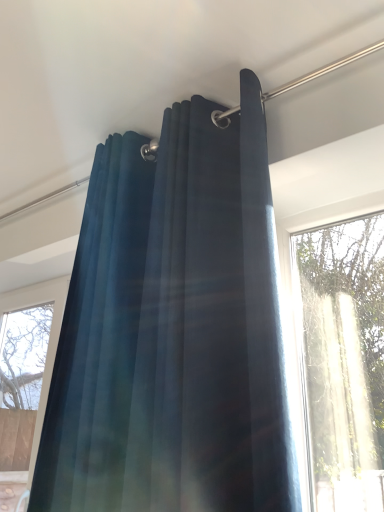
Locate an element on the screen. Image resolution: width=384 pixels, height=512 pixels. velvet dark blue curtain at left is located at coordinates (98, 339).

This screenshot has width=384, height=512. What do you see at coordinates (98, 339) in the screenshot?
I see `velvet dark blue curtain at left` at bounding box center [98, 339].

Locate an element on the screen. velvet dark blue curtain at upper center is located at coordinates pos(174,329).

In order to face velvet dark blue curtain at upper center, should I rotate leftwards or rightwards?

Turn right by 2.327 degrees to look at velvet dark blue curtain at upper center.

Measure the distance between point (75, 346) and camera.

Point (75, 346) and camera are 1.02 meters apart from each other.

The height and width of the screenshot is (512, 384). What do you see at coordinates (174, 329) in the screenshot? I see `velvet dark blue curtain at upper center` at bounding box center [174, 329].

Locate an element on the screen. Image resolution: width=384 pixels, height=512 pixels. velvet dark blue curtain at left is located at coordinates (98, 339).

Does velvet dark blue curtain at left appear on the left side of velvet dark blue curtain at upper center?

Correct, you'll find velvet dark blue curtain at left to the left of velvet dark blue curtain at upper center.

Is velvet dark blue curtain at left in front of or behind velvet dark blue curtain at upper center in the image?

Clearly, velvet dark blue curtain at left is behind velvet dark blue curtain at upper center.

Which is in front, point (136, 300) or point (81, 283)?

The point (136, 300) is in front.

From the image's perspective, is velvet dark blue curtain at left located above or below velvet dark blue curtain at upper center?

From the image's perspective, velvet dark blue curtain at left appears below velvet dark blue curtain at upper center.

From a real-world perspective, who is located higher, velvet dark blue curtain at left or velvet dark blue curtain at upper center?

In real-world perspective, velvet dark blue curtain at upper center is above.

Considering the sizes of velvet dark blue curtain at left and velvet dark blue curtain at upper center in the image, is velvet dark blue curtain at left wider or thinner than velvet dark blue curtain at upper center?

velvet dark blue curtain at left is thinner than velvet dark blue curtain at upper center.

Is velvet dark blue curtain at left taller than velvet dark blue curtain at upper center?

Correct, velvet dark blue curtain at left is much taller as velvet dark blue curtain at upper center.

Can you confirm if velvet dark blue curtain at left is bigger than velvet dark blue curtain at upper center?

Incorrect, velvet dark blue curtain at left is not larger than velvet dark blue curtain at upper center.

Would you say velvet dark blue curtain at left is inside or outside velvet dark blue curtain at upper center?

velvet dark blue curtain at left is not inside velvet dark blue curtain at upper center, it's outside.

Is velvet dark blue curtain at left not close to velvet dark blue curtain at upper center?

No, velvet dark blue curtain at left is not far away from velvet dark blue curtain at upper center.

From the picture: Is velvet dark blue curtain at left aimed at velvet dark blue curtain at upper center?

No, velvet dark blue curtain at left is not facing towards velvet dark blue curtain at upper center.

How many degrees apart are the facing directions of velvet dark blue curtain at left and velvet dark blue curtain at upper center?

The facing directions of velvet dark blue curtain at left and velvet dark blue curtain at upper center are 0.00162 degrees apart.

The height and width of the screenshot is (512, 384). In order to click on curtain lying on the right of velvet dark blue curtain at left in this screenshot , I will do `click(174, 329)`.

Visually, is velvet dark blue curtain at upper center positioned to the left or to the right of velvet dark blue curtain at left?

velvet dark blue curtain at upper center is to the right of velvet dark blue curtain at left.

Is velvet dark blue curtain at upper center positioned before velvet dark blue curtain at left?

Yes.

Which is less distant, (80, 345) or (88, 426)?

Point (80, 345) appears to be farther away from the viewer than point (88, 426).

From the image's perspective, is velvet dark blue curtain at upper center over velvet dark blue curtain at left?

Yes, from the image's perspective, velvet dark blue curtain at upper center is over velvet dark blue curtain at left.

From a real-world perspective, is velvet dark blue curtain at upper center located beneath velvet dark blue curtain at left?

No, from a real-world perspective, velvet dark blue curtain at upper center is not beneath velvet dark blue curtain at left.

Is velvet dark blue curtain at upper center wider than velvet dark blue curtain at left?

Yes, velvet dark blue curtain at upper center is wider than velvet dark blue curtain at left.

Does velvet dark blue curtain at upper center have a lesser height compared to velvet dark blue curtain at left?

Yes, velvet dark blue curtain at upper center is shorter than velvet dark blue curtain at left.

Looking at this image, does velvet dark blue curtain at upper center have a larger size compared to velvet dark blue curtain at left?

Yes.

Consider the image. Is velvet dark blue curtain at left completely or partially inside velvet dark blue curtain at upper center?

No, velvet dark blue curtain at left is not inside velvet dark blue curtain at upper center.

In the scene shown: Is velvet dark blue curtain at upper center far from velvet dark blue curtain at left?

velvet dark blue curtain at upper center is actually quite close to velvet dark blue curtain at left.

Is velvet dark blue curtain at upper center oriented towards velvet dark blue curtain at left?

No, velvet dark blue curtain at upper center is not facing towards velvet dark blue curtain at left.

Measure the distance from velvet dark blue curtain at upper center to velvet dark blue curtain at left.

velvet dark blue curtain at upper center is 3.54 inches away from velvet dark blue curtain at left.

In order to click on curtain in front of the velvet dark blue curtain at left in this screenshot , I will do `click(174, 329)`.

Find the location of a particular element. This screenshot has height=512, width=384. curtain lying above the velvet dark blue curtain at left (from the image's perspective) is located at coordinates (174, 329).

You are a GUI agent. You are given a task and a screenshot of the screen. Output one action in this format:
    pyautogui.click(x=<x>, y=<y>)
    Task: Click on the curtain in front of the velvet dark blue curtain at left
    
    Given the screenshot: What is the action you would take?
    pyautogui.click(x=174, y=329)